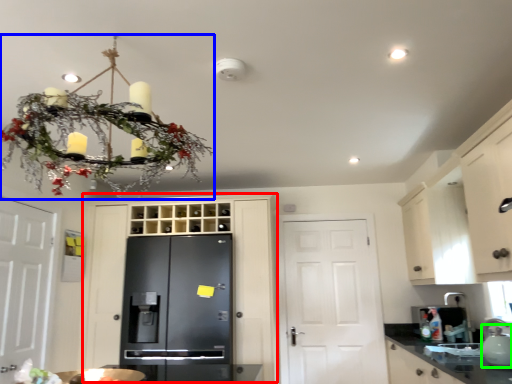
Question: Estimate the real-world distances between objects in this image. Which object is farther from door (highlighted by a red box), chandelier (highlighted by a blue box) or tea pot (highlighted by a green box)?

Choices:
 (A) chandelier
 (B) tea pot

Answer: (B)